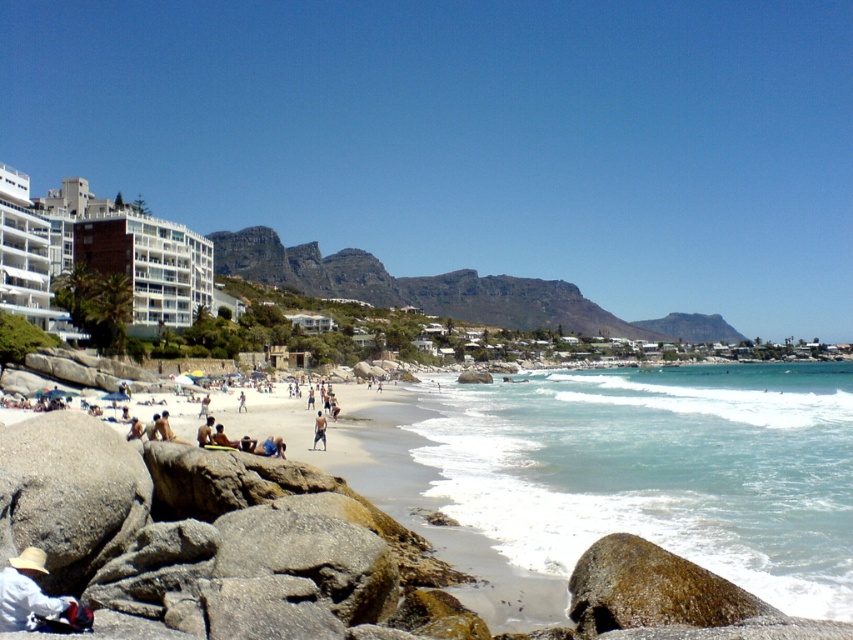
Looking at this image, you are standing at point (68, 492) on the beach. What object is located at that exact point?

The gray rough boulder at lower left is located at point (68, 492).

Consider the image. You are standing on the beach and want to place a 1.5 meter long wooden bench between the gray rough boulder at lower left and the nearest mountain. Is there enough space?

The gray rough boulder at lower left and the nearest mountain are 39.13 meters apart. Since the bench is only 1.5 meters long, there is more than enough space to place it between them.